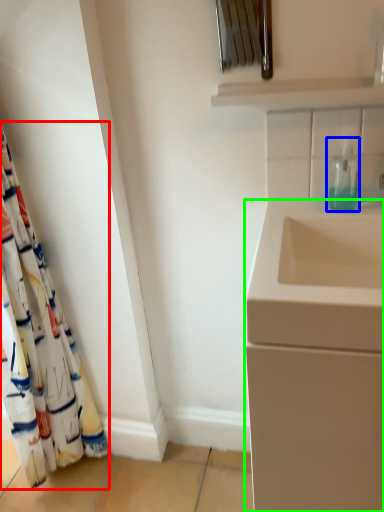
Question: Estimate the real-world distances between objects in this image. Which object is farther from curtain (highlighted by a red box), soap dispenser (highlighted by a blue box) or bathroom cabinet (highlighted by a green box)?

Choices:
 (A) soap dispenser
 (B) bathroom cabinet

Answer: (A)